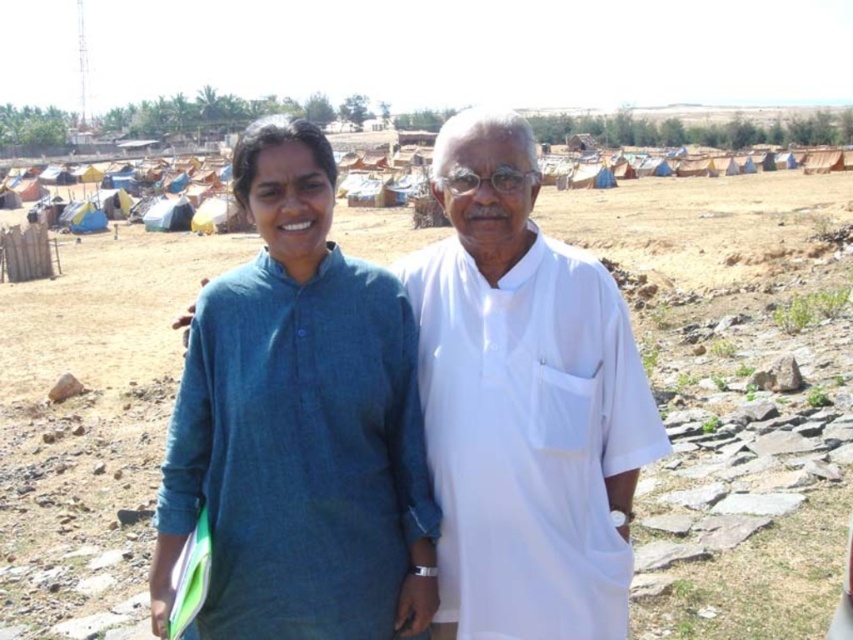
You are standing in the rural setting and want to walk from point A to point B. Point A is at coordinates point (138, 332) and point B is at coordinates point (300, 470). Since you can only move forward, will you be moving towards or away from the shelters in the background?

Since point (138, 332) is closer to you than point (300, 470), moving from point A to point B would mean moving away from the shelters in the background.

You are standing at the point marked as point (732, 394) in the image. Looking around, you see the brown soil at center. What is the color of the ground beneath you?

The brown soil at center is located at point (732, 394), so the ground beneath you is brown.

You are a photographer aiming to capture the white cotton kurta at center and the brown soil at center in a single frame. Based on their positions, which object is located to the right of the other?

The brown soil at center is to the right of the white cotton kurta at center.